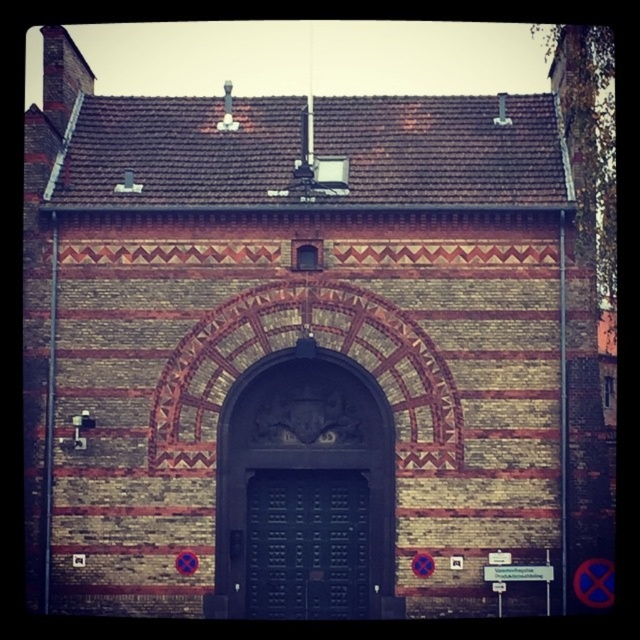
Question: Which object appears farthest from the camera in this image?

Choices:
 (A) dark wood door at center
 (B) dark green wooden door at center

Answer: (A)

Question: Is dark green wooden door at center wider than dark wood door at center?

Choices:
 (A) yes
 (B) no

Answer: (A)

Question: Does dark green wooden door at center have a greater width compared to dark wood door at center?

Choices:
 (A) yes
 (B) no

Answer: (A)

Question: Does dark green wooden door at center appear on the right side of dark wood door at center?

Choices:
 (A) no
 (B) yes

Answer: (B)